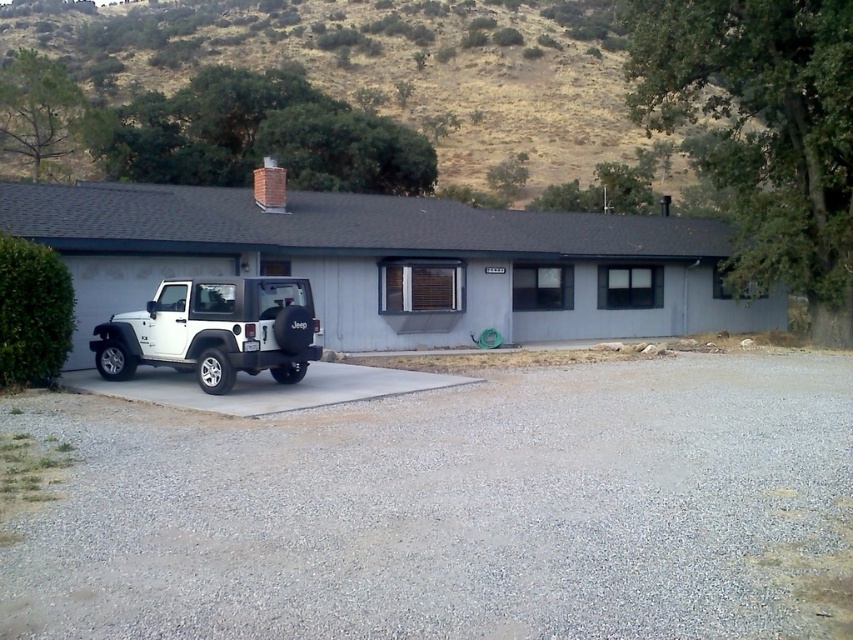
You are a delivery person trying to park a new vehicle that is 1.5 meters wide on the driveway. The driveway has gray gravel at lower left and a white matte jeep at lower left parked there. Which area between the two objects can accommodate your vehicle?

The gray gravel at lower left has a larger width than the white matte jeep at lower left, so the gray gravel at lower left can accommodate the new vehicle since its width is sufficient for the 1.5 meters wide vehicle.

You are standing in front of the house and want to walk to the white matte jeep at lower left. Which direction should you move relative to the dried grass at upper center?

You should move to the right relative to the dried grass at upper center because the white matte jeep at lower left is to the right of the dried grass at upper center.

You are standing in front of the house and notice two areas on the ground. One has gray gravel at lower left and the other has dried grass at upper center. Which area is positioned to the right when viewed from your perspective?

The gray gravel at lower left is to the right of dried grass at upper center.